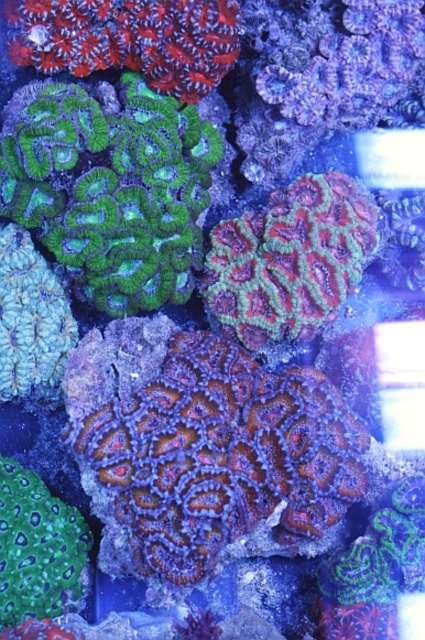
Question: Which point appears closest to the camera in this image?

Choices:
 (A) (82, 372)
 (B) (47, 536)

Answer: (B)

Question: Is textured coral at center positioned behind green textured coral at lower left?

Choices:
 (A) no
 (B) yes

Answer: (A)

Question: Is green textured coral at center bigger than green textured coral at lower left?

Choices:
 (A) no
 (B) yes

Answer: (B)

Question: Can you confirm if textured coral at center is positioned to the right of green textured coral at center?

Choices:
 (A) yes
 (B) no

Answer: (B)

Question: Which of these objects is positioned closest to the green textured coral at center?

Choices:
 (A) green textured coral at lower left
 (B) textured coral at center

Answer: (B)

Question: Which object is farther from the camera taking this photo?

Choices:
 (A) green textured coral at center
 (B) green textured coral at lower left

Answer: (A)